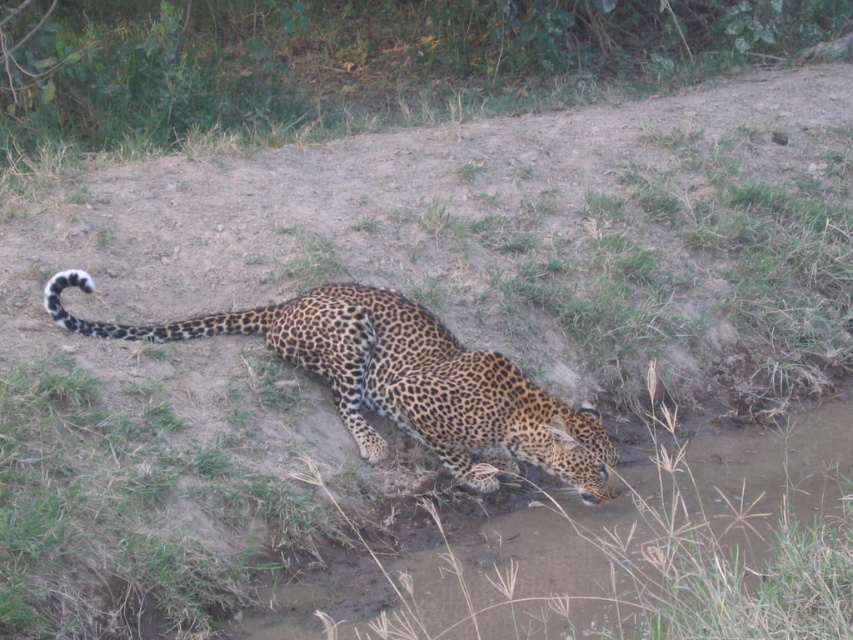
Based on the photo, you are a wildlife photographer trying to capture the leopard in the image. You notice the spotted fur cheetah at lower center and the spotted fur tail at lower center. Which of these two features is wider when viewed from your camera lens?

The spotted fur cheetah at lower center is wider than the spotted fur tail at lower center.

You are a wildlife photographer aiming to capture a closeup shot of the spotted fur cheetah at lower center and the spotted fur tail at lower center. Your camera can focus on objects within 50 centimeters of each other. Can you take a clear photo of both subjects at the same time?

The distance between the spotted fur cheetah at lower center and the spotted fur tail at lower center is 52.54 centimeters. Since the camera requires subjects to be within 50 centimeters for clear focus, the distance exceeds the limit. Therefore, you cannot take a clear photo of both subjects simultaneously.

Based on the photo, you are a wildlife photographer trying to capture the leopard in the scene. You notice the spotted fur cheetah at lower center and the spotted fur tail at lower center. Which object should you focus on first if you want to photograph the leopard from a lower angle?

The spotted fur cheetah at lower center is taller than the spotted fur tail at lower center. Therefore, focusing on the spotted fur cheetah at lower center first would allow you to capture the leopard from a lower angle since it is the taller object.